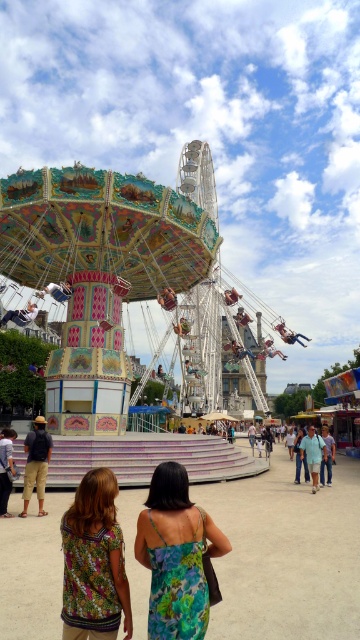
You are standing at the entrance of the fairground and see two points in the distance. The first point is labeled as point (2, 509) and the second is point (23, 316). Which point is nearer to you?

Point (2, 509) is closer to the viewer than point (23, 316).

You are standing at the fairground and see a person wearing dark blue shirt at lower left and dark blue denim jeans at lower left. Which part of their clothing is on the right side?

The dark blue shirt at lower left is positioned on the right side of dark blue denim jeans at lower left.

Based on the photo, you are standing at the fairground and want to take a photo of the dark blue shirt at lower left and the dark blue denim jeans at lower left. If your camera has a maximum focus range of 3 meters, will both items be in focus at the same time?

The dark blue shirt at lower left is 2.81 meters away from dark blue denim jeans at lower left. Since the maximum focus range is 3 meters, both items will be within the focus range and can be in focus simultaneously.